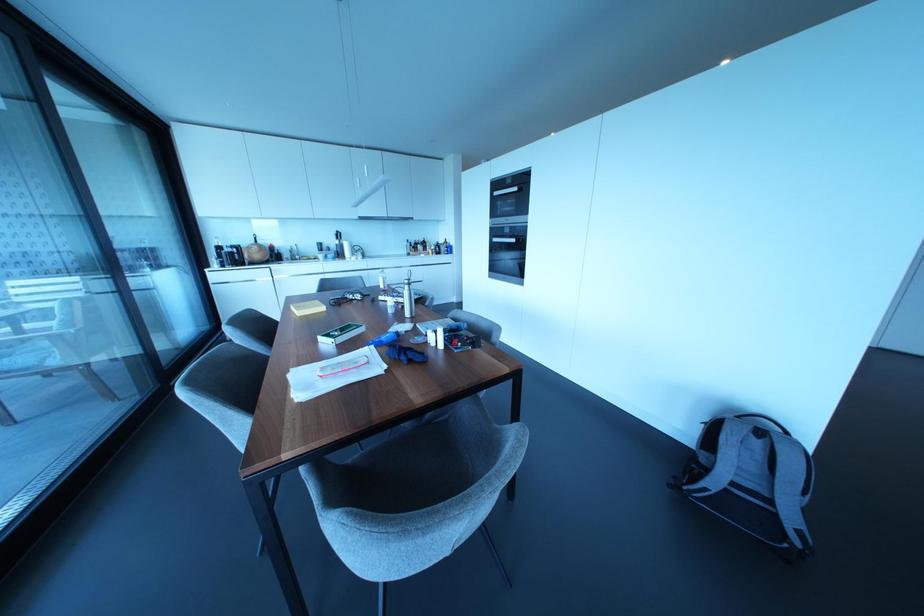
Find the location of `black eyeglasses`. black eyeglasses is located at coordinates (347, 297).